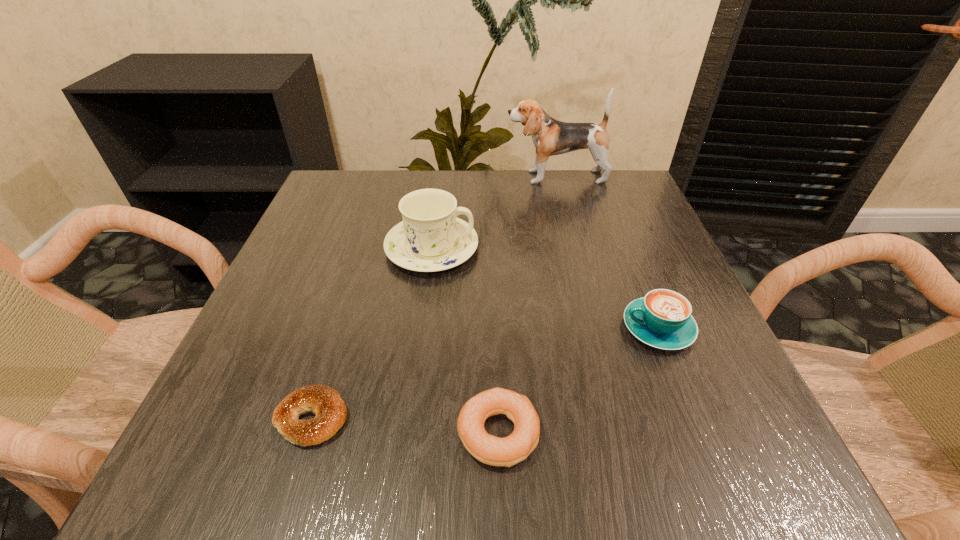
Find the location of `free space that is in between the right bagel and the second tallest object`. free space that is in between the right bagel and the second tallest object is located at coordinates (465, 340).

This screenshot has width=960, height=540. What are the coordinates of `free spot between the shortest object and the chinaware` in the screenshot? It's located at coord(372,333).

Select which object is the fourth closest to the shortest object. Please provide its 2D coordinates. Your answer should be formatted as a tuple, i.e. [(x, y)], where the tuple contains the x and y coordinates of a point satisfying the conditions above.

[(550, 137)]

This screenshot has height=540, width=960. What are the coordinates of `object that can be found as the third closest to the chinaware` in the screenshot? It's located at 662,319.

Where is `free region that satisfies the following two spatial constraints: 1. at the face of the farthest object; 2. on the front side of the shorter bagel`? free region that satisfies the following two spatial constraints: 1. at the face of the farthest object; 2. on the front side of the shorter bagel is located at coordinates (617, 418).

Identify the location of free spot that satisfies the following two spatial constraints: 1. at the face of the tallest object; 2. on the front side of the shortest object. (617, 418).

This screenshot has width=960, height=540. Find the location of `vacant position in the image that satisfies the following two spatial constraints: 1. on the handle side of the second farthest object; 2. on the front side of the left bagel`. vacant position in the image that satisfies the following two spatial constraints: 1. on the handle side of the second farthest object; 2. on the front side of the left bagel is located at coordinates (410, 418).

The width and height of the screenshot is (960, 540). In order to click on blank space that satisfies the following two spatial constraints: 1. on the handle side of the fourth nearest object; 2. on the right side of the taller bagel in this screenshot , I will do `click(408, 433)`.

Find the location of a particular element. Image resolution: width=960 pixels, height=540 pixels. free space that satisfies the following two spatial constraints: 1. on the handle side of the taller bagel; 2. on the left side of the fourth shortest object is located at coordinates (408, 433).

Where is `vacant position in the image that satisfies the following two spatial constraints: 1. on the back side of the taller bagel; 2. on the handle side of the chinaware`? vacant position in the image that satisfies the following two spatial constraints: 1. on the back side of the taller bagel; 2. on the handle side of the chinaware is located at coordinates (492, 248).